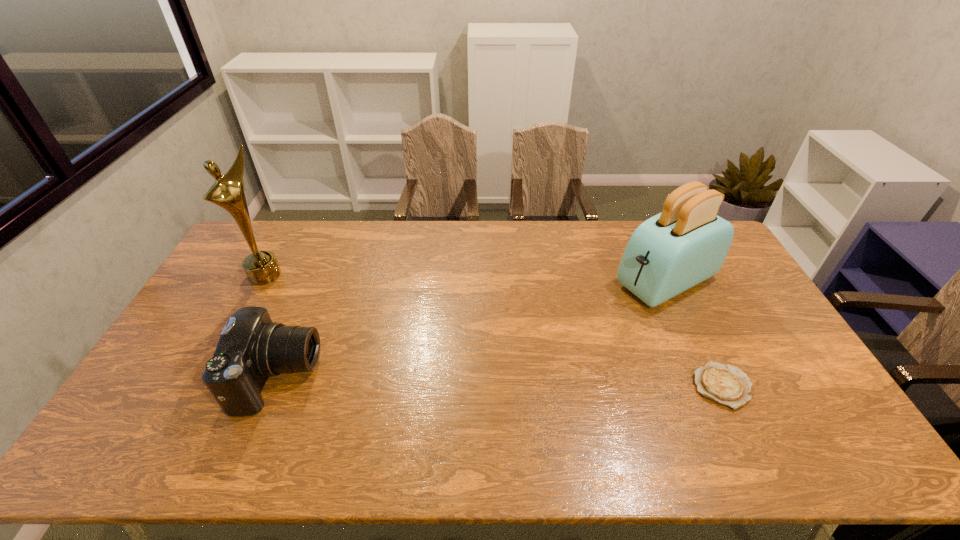
I want to click on vacant space located 0.160m on the side of the toaster with the lever, so click(x=589, y=317).

I want to click on free space located on the front-facing side of the tallest object, so click(337, 321).

Identify the location of free region located 0.250m on the front-facing side of the tallest object. (324, 313).

Where is `blank space located on the front-facing side of the tallest object`? The width and height of the screenshot is (960, 540). blank space located on the front-facing side of the tallest object is located at coordinates (316, 308).

Locate an element on the screen. object that is at the far edge is located at coordinates (687, 243).

At what (x,y) coordinates should I click in order to perform the action: click on camera at the near edge. Please return your answer as a coordinate pair (x, y). This screenshot has height=540, width=960. Looking at the image, I should click on (251, 348).

At what (x,y) coordinates should I click in order to perform the action: click on quiche situated at the near edge. Please return your answer as a coordinate pair (x, y). The image size is (960, 540). Looking at the image, I should click on (727, 385).

The width and height of the screenshot is (960, 540). In order to click on object present at the left edge in this screenshot , I will do `click(228, 191)`.

Locate an element on the screen. The height and width of the screenshot is (540, 960). object located in the right edge section of the desktop is located at coordinates (687, 243).

Locate an element on the screen. The height and width of the screenshot is (540, 960). object present at the far right corner is located at coordinates (687, 243).